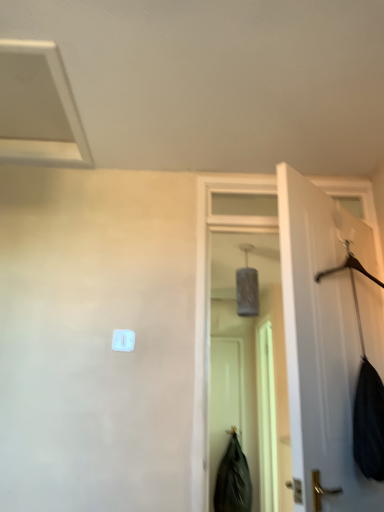
Question: Considering the positions of white plastic light switch at center and white plastic exhaust hood at upper left in the image, is white plastic light switch at center wider or thinner than white plastic exhaust hood at upper left?

Choices:
 (A) wide
 (B) thin

Answer: (B)

Question: Considering the positions of white plastic light switch at center and white plastic exhaust hood at upper left in the image, is white plastic light switch at center taller or shorter than white plastic exhaust hood at upper left?

Choices:
 (A) tall
 (B) short

Answer: (A)

Question: Estimate the real-world distances between objects in this image. Which object is farther from the black matte screen door at center, the second screen door from the right?

Choices:
 (A) black matte coat at lower center
 (B) white plastic exhaust hood at upper left
 (C) white plastic light switch at center
 (D) white matte door at right
 (E) translucent plastic screen door at center, positioned as the second screen door in left-to-right order

Answer: (B)

Question: Considering the real-world distances, which object is farthest from the white plastic light switch at center?

Choices:
 (A) black matte screen door at center, the first screen door when ordered from left to right
 (B) black matte coat at lower center
 (C) white matte door at right
 (D) white plastic exhaust hood at upper left
 (E) translucent plastic screen door at center, which is the 1th screen door in right-to-left order

Answer: (E)